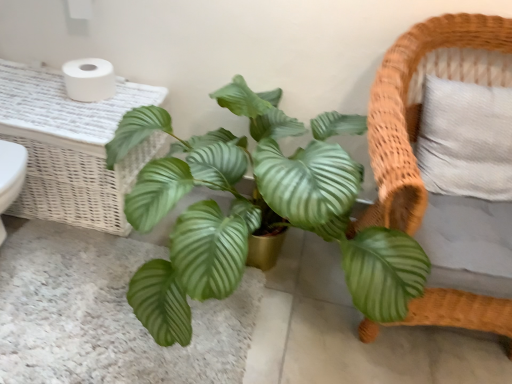
Locate an element on the screen. free location to the left of white matte toilet paper at upper left is located at coordinates (44, 83).